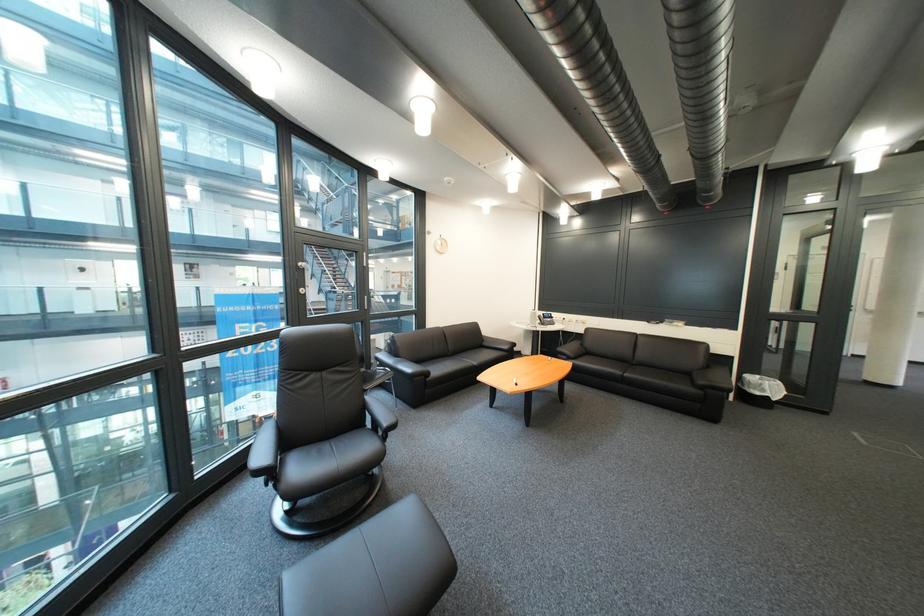
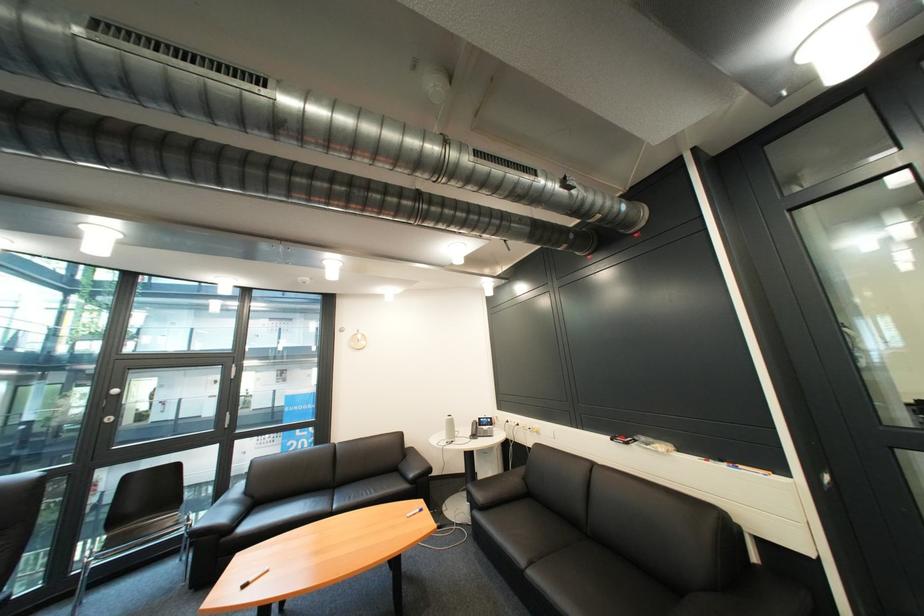
Find the pixel in the second image that matches [556,315] in the first image.

(492, 419)